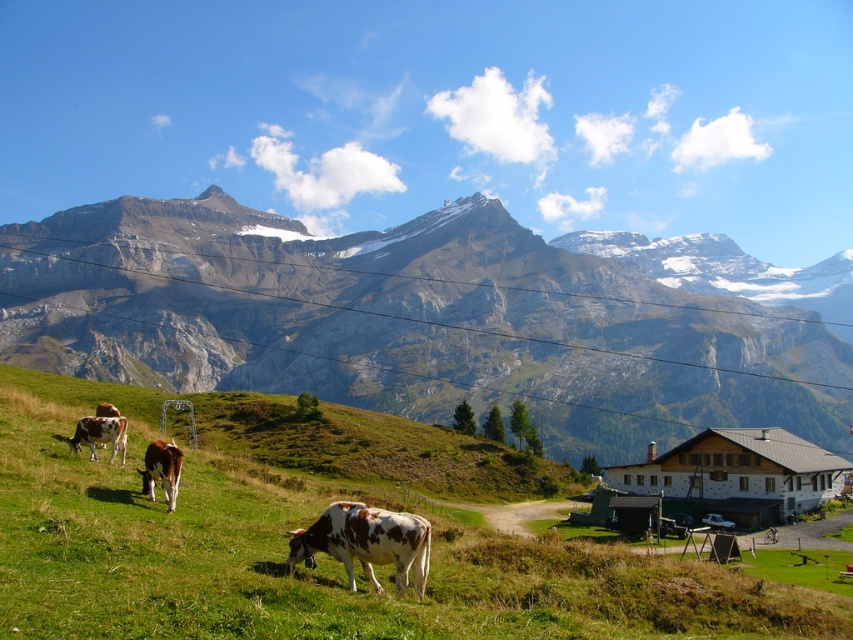
Question: Estimate the real-world distances between objects in this image. Which object is closer to the brown and white spotted cow at lower center?

Choices:
 (A) green grassy at lower left
 (B) brown and white spotted cow at lower left

Answer: (A)

Question: Is green grassy at lower left thinner than brown speckled cow at lower left?

Choices:
 (A) yes
 (B) no

Answer: (B)

Question: Can you confirm if green grassy at lower left is smaller than brown speckled cow at lower left?

Choices:
 (A) no
 (B) yes

Answer: (A)

Question: Does rocky gray mountain range at upper center appear under green grassy at lower left?

Choices:
 (A) no
 (B) yes

Answer: (A)

Question: Which point appears farthest from the camera in this image?

Choices:
 (A) 329,522
 (B) 167,483

Answer: (B)

Question: Which point is farther to the camera?

Choices:
 (A) (173, 497)
 (B) (345, 428)

Answer: (B)